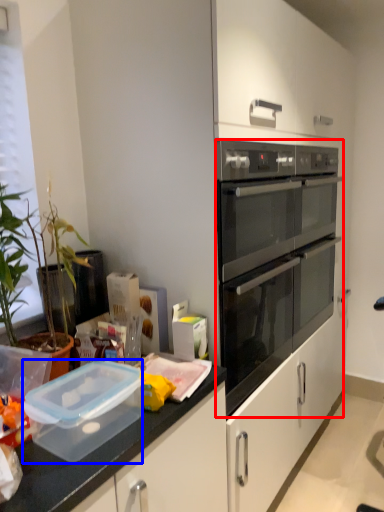
Question: Which object is further to the camera taking this photo, oven (highlighted by a red box) or appliance (highlighted by a blue box)?

Choices:
 (A) oven
 (B) appliance

Answer: (A)